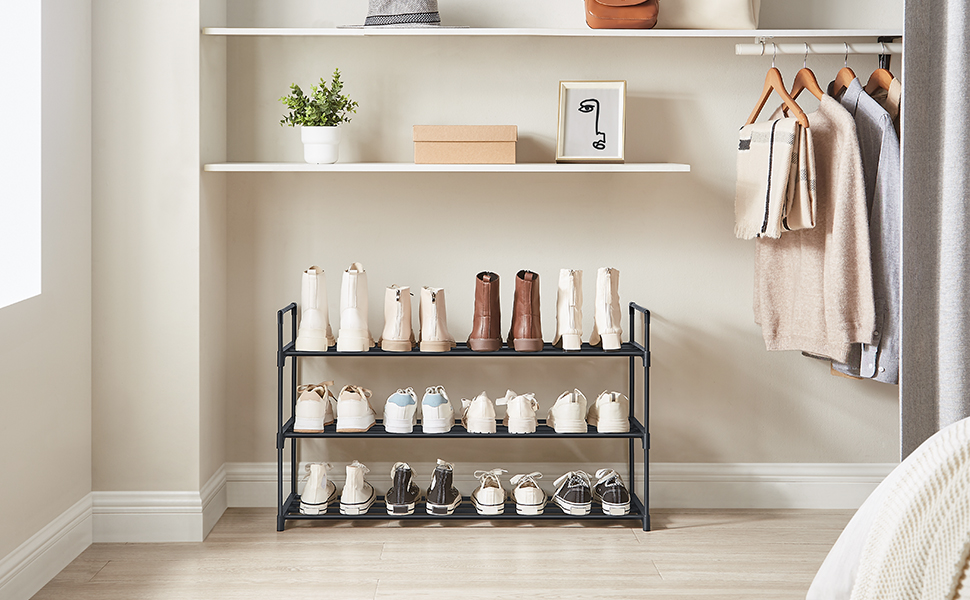
I want to click on hangers, so click(x=769, y=72), click(x=805, y=80), click(x=844, y=81), click(x=878, y=80).